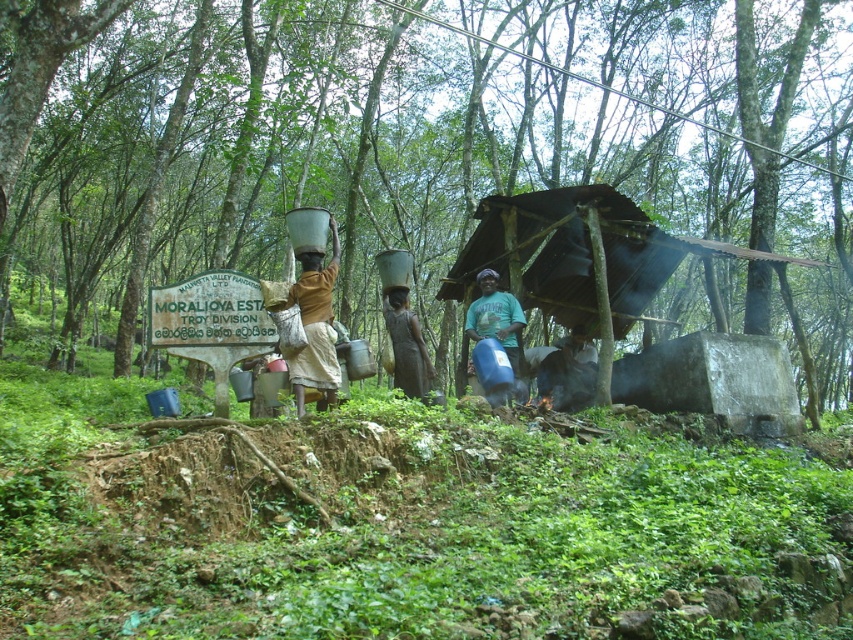
You are a hiker who needs to keep your snacks cool. You see a brown fabric at center and a charcoal gray stone pot at lower center. Which object can you use to cover and keep your snacks cool?

The brown fabric at center is positioned over charcoal gray stone pot at lower center, so you can use the brown fabric at center to cover and keep your snacks cool.

You are a hiker who needs to place a 10 feet long tent between the brown fabric at center and the charcoal gray stone pot at lower center. Can you fit it there without overlapping either object?

The distance between the brown fabric at center and the charcoal gray stone pot at lower center is 13.14 feet. Since the tent is 10 feet long, there is enough space to place it between them without overlapping either object.

From the picture: You are a hiker who wants to take a photo of the charcoal gray stone pot at lower center without the green leafy forest at center blocking the view. How should you adjust your position?

The green leafy forest at center is much taller than the charcoal gray stone pot at lower center, so you should move backward to get a lower angle or position yourself higher to avoid the forest blocking the view.